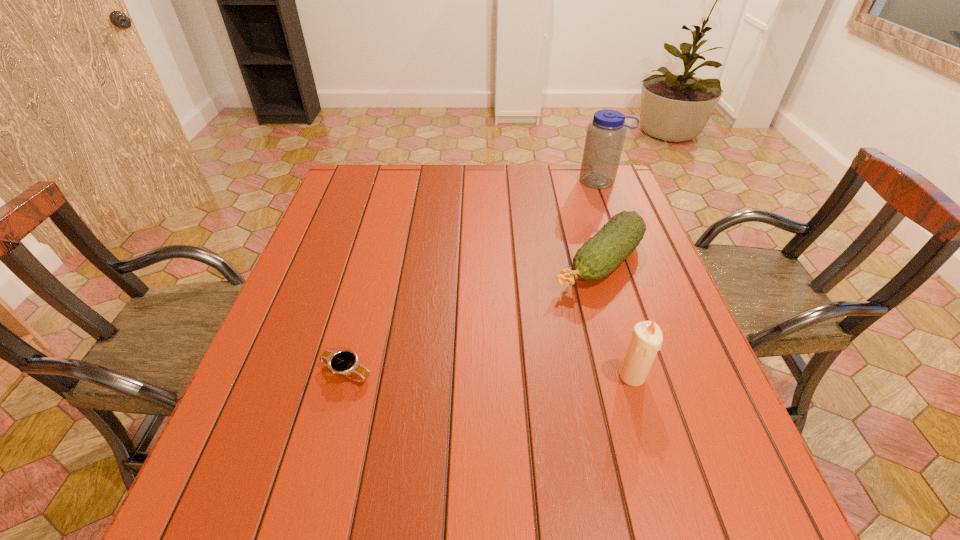
Identify the location of free spot between the tallest object and the third tallest object. This screenshot has height=540, width=960. [x=599, y=221].

In order to click on free space between the cucumber and the tallest object in this screenshot , I will do `click(599, 221)`.

I want to click on empty space between the second farthest object and the third shortest object, so tap(615, 319).

The height and width of the screenshot is (540, 960). What are the coordinates of `empty space that is in between the cucumber and the tallest object` in the screenshot? It's located at click(599, 221).

The height and width of the screenshot is (540, 960). I want to click on free space between the third shortest object and the cucumber, so click(615, 319).

Locate an element on the screen. The width and height of the screenshot is (960, 540). free spot between the candle and the tallest object is located at coordinates (616, 279).

Image resolution: width=960 pixels, height=540 pixels. I want to click on free point between the second tallest object and the farthest object, so click(x=616, y=279).

Identify which object is the nearest to the third shortest object. Please provide its 2D coordinates. Your answer should be formatted as a tuple, i.e. [(x, y)], where the tuple contains the x and y coordinates of a point satisfying the conditions above.

[(599, 256)]

Identify which object is located as the second nearest to the shortest object. Please provide its 2D coordinates. Your answer should be formatted as a tuple, i.e. [(x, y)], where the tuple contains the x and y coordinates of a point satisfying the conditions above.

[(646, 341)]

Where is `vacant area that satisfies the following two spatial constraints: 1. on the back side of the candle; 2. on the right side of the tallest object`? vacant area that satisfies the following two spatial constraints: 1. on the back side of the candle; 2. on the right side of the tallest object is located at coordinates (574, 181).